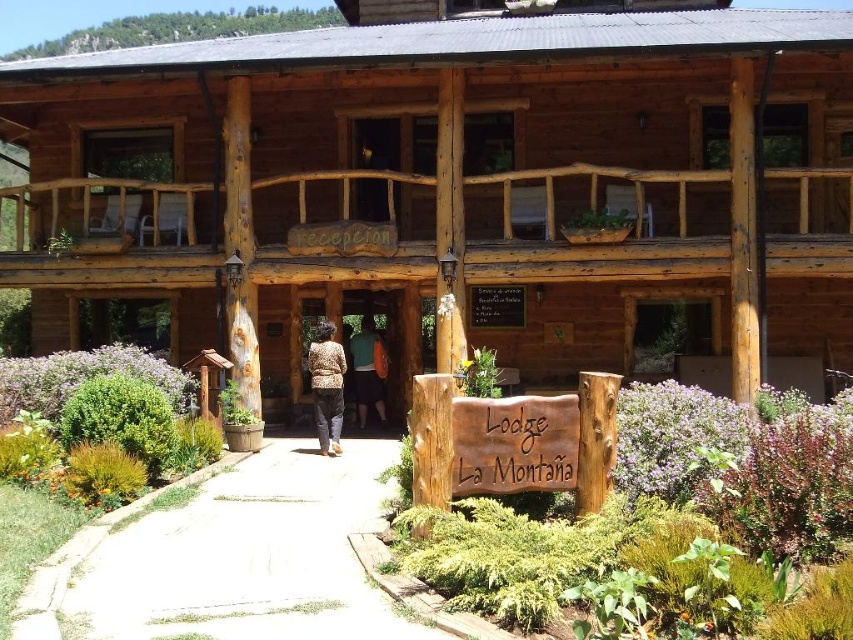
You are a guest arriving at Lodge La Montana and need to find the entrance. You see a white gravel path at center and a matte green backpack at center. Which object is smaller in size?

The white gravel path at center has a smaller size compared to the matte green backpack at center, so the white gravel path at center is smaller in size.

You are planning to hang a new welcome sign that is the same size as the brown wooden sign at center. If the wooden cabin at center is currently blocking the view of the sign from the main entrance, where should you place the new sign to ensure it is visible alongside the existing one?

Since the wooden cabin at center is larger than the brown wooden sign at center, you should place the new sign on the opposite side of the existing sign relative to the cabin to ensure both are visible without obstruction.